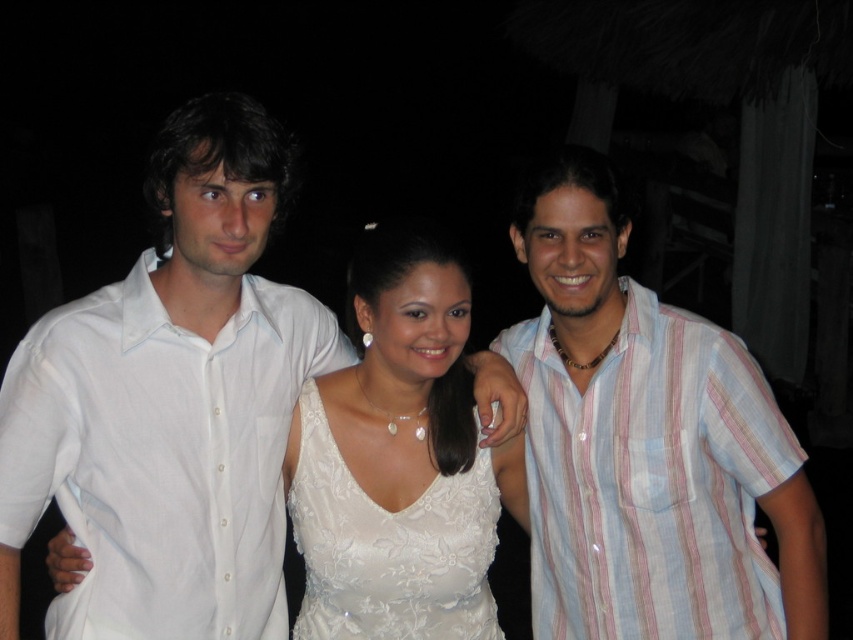
You are organizing a charity event and need to determine if the white cotton shirt at left and the white lace dress at center can fit into a storage box that measures 1.2 meters in length. Based on their sizes, will both items fit comfortably?

The white cotton shirt at left is bigger than the white lace dress at center. However, without specific measurements for each item, it is impossible to determine if they will fit into the 1.2 meter box. Additional information about their individual sizes is required.

You are at a party and need to find the white cotton shirt at left and the white lace dress at center. Which one is positioned more to the left side of the image?

The white cotton shirt at left is positioned more to the left side of the image than the white lace dress at center.

You are a photographer at a social event and want to take a photo of the light blue striped shirt at right and the white lace dress at center. Which one is positioned to the right of the other?

The light blue striped shirt at right is positioned on the right side of white lace dress at center.